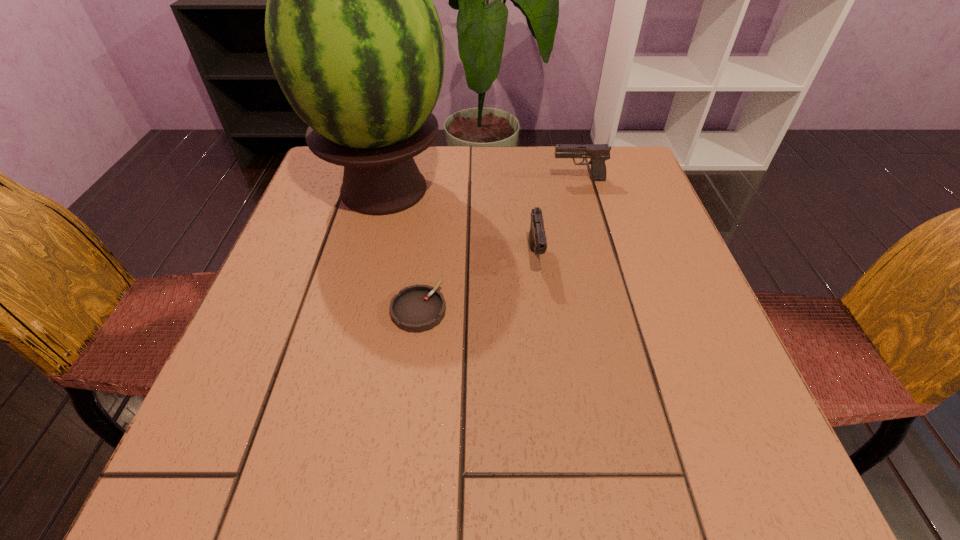
The height and width of the screenshot is (540, 960). I want to click on vacant space located aim along the barrel of the rightmost object, so click(532, 180).

Locate an element on the screen. vacant region located at the barrel of the nearer pistol is located at coordinates (566, 494).

This screenshot has width=960, height=540. In order to click on free region located 0.110m on the front of the nearest object in this screenshot , I will do `click(409, 389)`.

Locate an element on the screen. This screenshot has width=960, height=540. watermelon at the far edge is located at coordinates point(355,42).

Locate an element on the screen. This screenshot has height=540, width=960. pistol present at the far edge is located at coordinates (598, 153).

The image size is (960, 540). Find the location of `object that is positioned at the left edge`. object that is positioned at the left edge is located at coordinates (355, 42).

Where is `object that is at the right edge`? Image resolution: width=960 pixels, height=540 pixels. object that is at the right edge is located at coordinates (598, 153).

This screenshot has width=960, height=540. I want to click on object that is at the far left corner, so click(355, 42).

The width and height of the screenshot is (960, 540). Identify the location of object that is at the far right corner. (598, 153).

Locate an element on the screen. Image resolution: width=960 pixels, height=540 pixels. blank space at the far edge of the desktop is located at coordinates (556, 174).